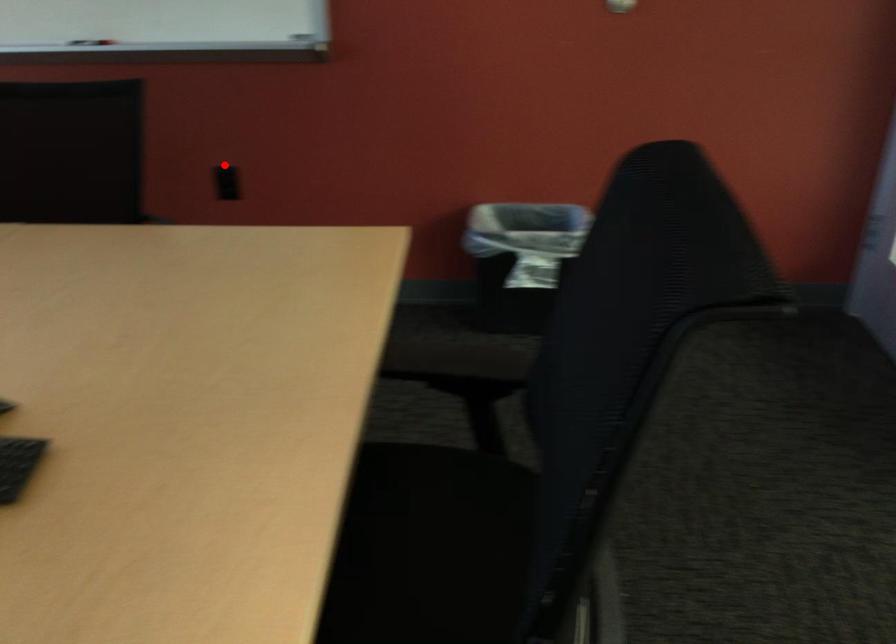
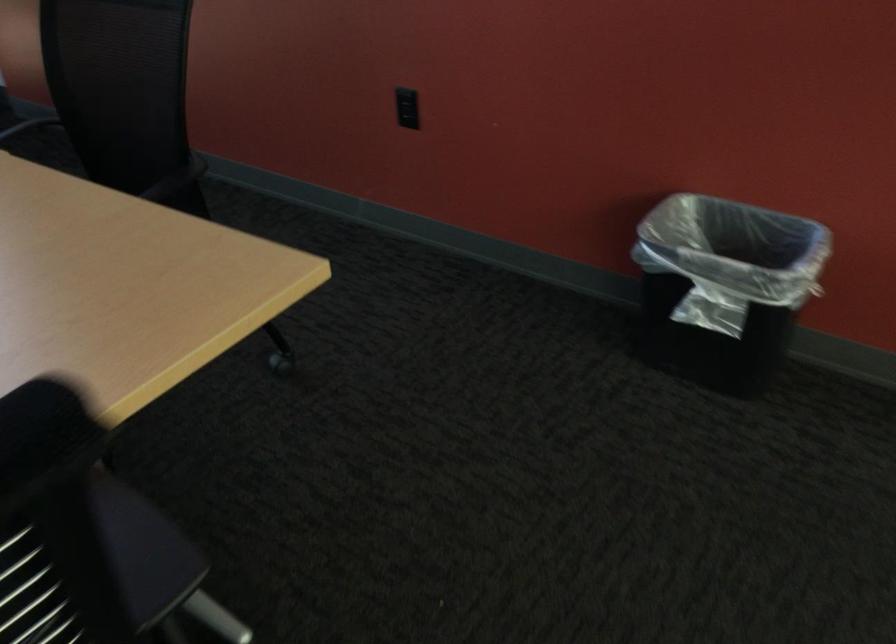
The point at the highlighted location is marked in the first image. Where is the corresponding point in the second image?

(407, 102)